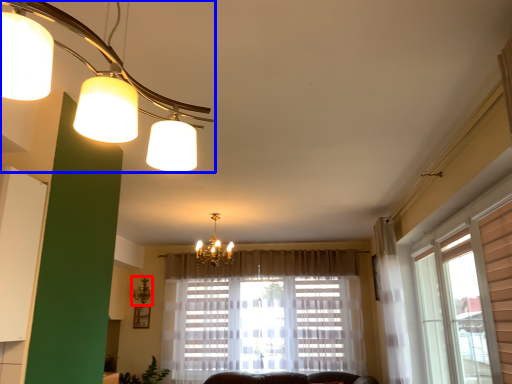
Question: Among these objects, which one is farthest to the camera, lamp (highlighted by a red box) or lamp (highlighted by a blue box)?

Choices:
 (A) lamp
 (B) lamp

Answer: (A)